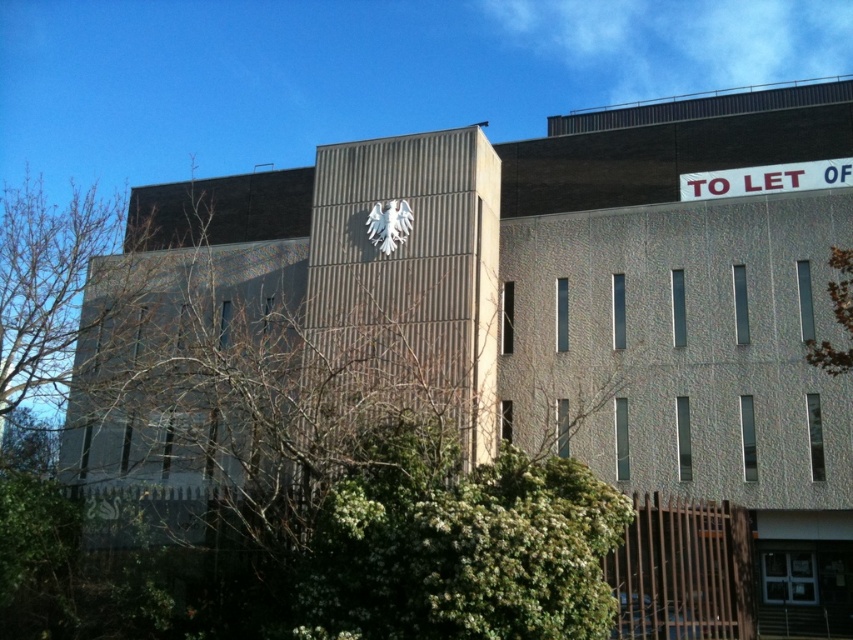
You are standing in front of the building and want to take a photo that includes the green leafy tree at right. Where should you position yourself relative to the building to ensure the tree is in the frame?

To include the green leafy tree at right in your photo, position yourself to the right side of the building since the tree is located at the right side.

You are a window installer assessing the building facade. You need to place a new window between the green leafy tree at upper center and the white matte eagle at upper center. Which object should you avoid placing the window behind to ensure visibility?

You should avoid placing the window behind the green leafy tree at upper center because it is larger than the white matte eagle at upper center and may obstruct the view.

You are standing at a point 50 meters away from the building. If you move towards the building, will you pass the point at coordinate (x=173, y=344) before reaching the building?

The point at coordinate (x=173, y=344) is 46.87 meters away from the camera. Since you are currently 50 meters away from the building, moving towards it would first bring you closer to the point before reaching the building itself. Therefore, yes, you will pass the point at coordinate (x=173, y=344) before arriving at the building.